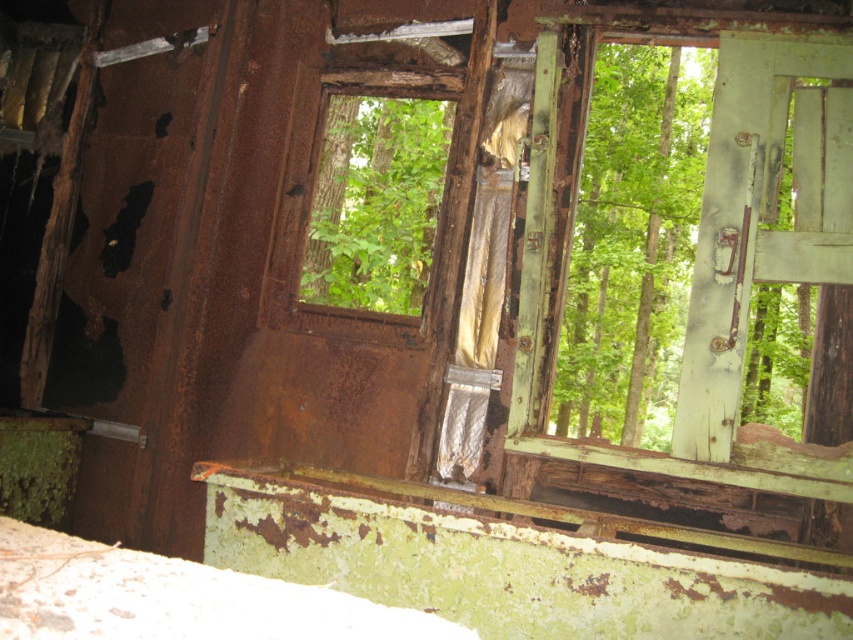
You are standing inside the dilapidated structure and notice a rusty wood window at center and a green leafy tree at center. Which object is located to the left of the other?

The rusty wood window at center is positioned on the left side of green leafy tree at center.

You are standing inside the dilapidated structure and notice two points marked on the wall. The first point is at coordinates point (x=363, y=104) and the second is at point (x=647, y=58). Which point is closer to your current position?

Point (x=363, y=104) is closer to the camera than point (x=647, y=58), so the first point is closer to your current position.